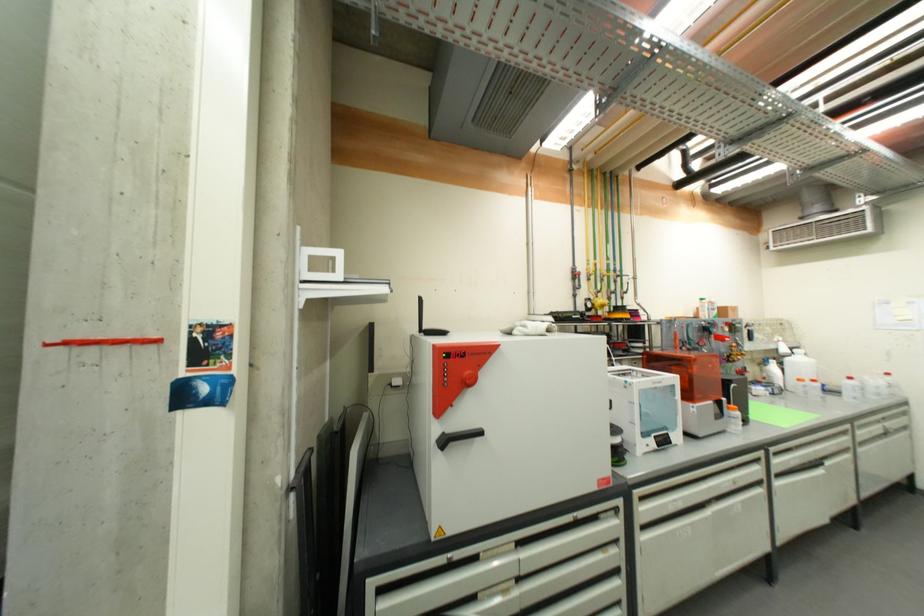
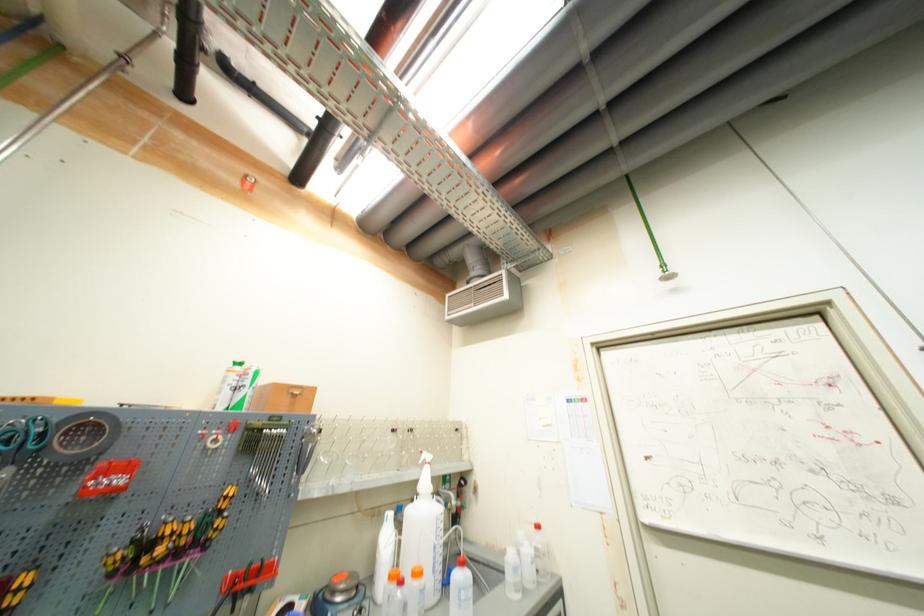
In the second image, find the point that corresponds to point 670,205 in the first image.

(253, 185)